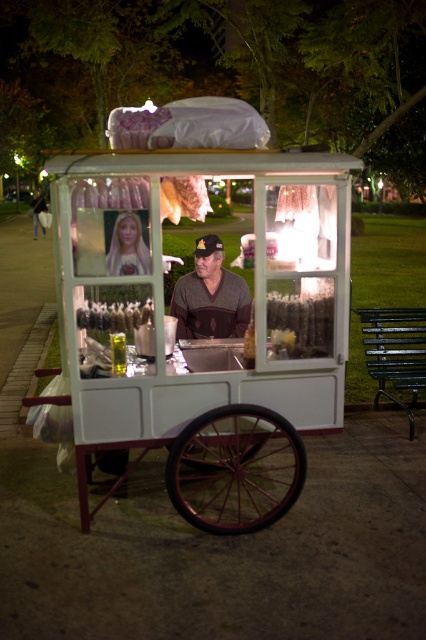
Between white wood cart at center and dark brown sweater at center, which one appears on the left side from the viewer's perspective?

Positioned to the left is white wood cart at center.

Which is below, white wood cart at center or dark brown sweater at center?

Positioned lower is white wood cart at center.

Is point (109, 168) closer to camera compared to point (192, 289)?

Yes, it is.

At what (x,y) coordinates should I click in order to perform the action: click on white wood cart at center. Please return your answer as a coordinate pair (x, y). Looking at the image, I should click on (207, 339).

Can you confirm if dark brown sweater at center is smaller than white plastic popcorn at center?

No.

Describe the element at coordinates (210, 296) in the screenshot. I see `dark brown sweater at center` at that location.

The height and width of the screenshot is (640, 426). What are the coordinates of `dark brown sweater at center` in the screenshot? It's located at (210, 296).

Can you confirm if white wood cart at center is smaller than blonde hair at center?

Incorrect, white wood cart at center is not smaller in size than blonde hair at center.

Which is behind, point (138, 428) or point (115, 272)?

Positioned behind is point (138, 428).

Identify the location of white wood cart at center. (207, 339).